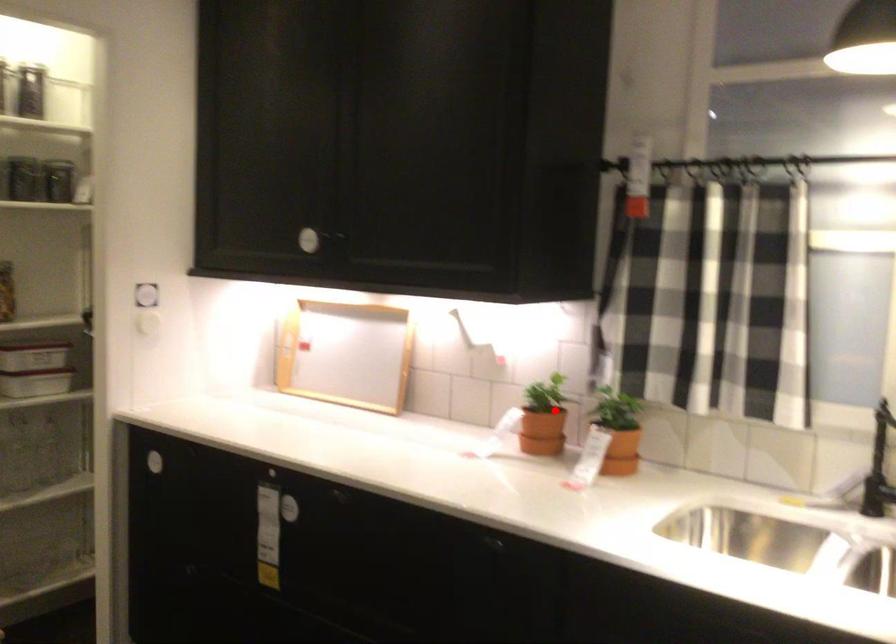
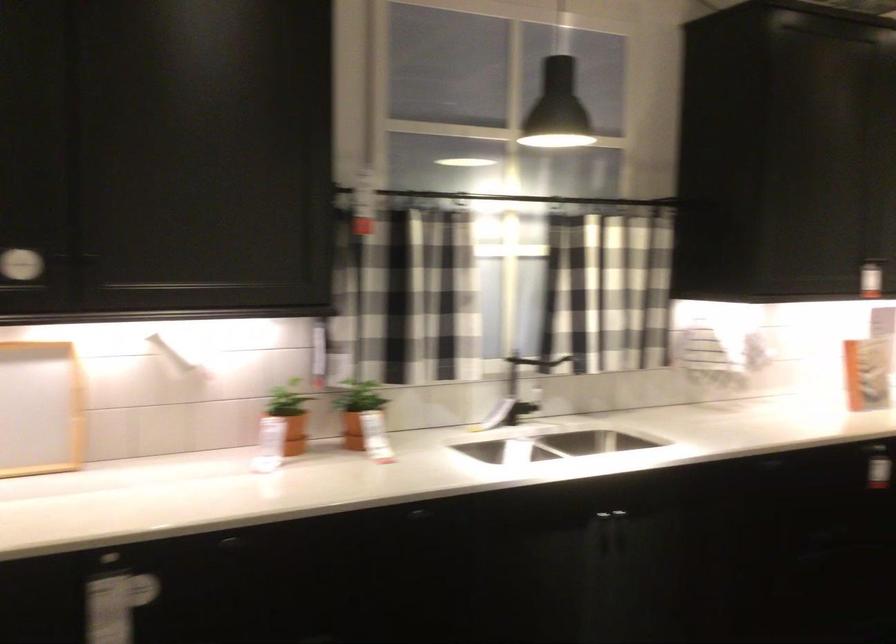
In the second image, find the point that corresponds to the highlighted location in the first image.

(289, 415)